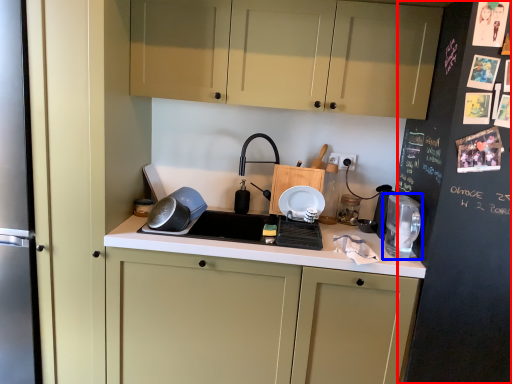
Question: Which object is closer to the camera taking this photo, bulletin board (highlighted by a red box) or home appliance (highlighted by a blue box)?

Choices:
 (A) bulletin board
 (B) home appliance

Answer: (A)